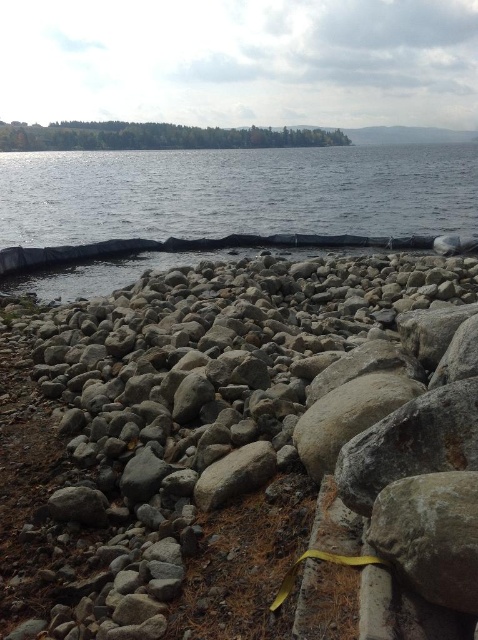
Who is lower down, gray rock shoreline at lower left or clear water at center?

gray rock shoreline at lower left is lower down.

Is point (444, 384) in front of point (8, 285)?

Yes, point (444, 384) is closer to viewer.

Locate an element on the screen. gray rock shoreline at lower left is located at coordinates (246, 435).